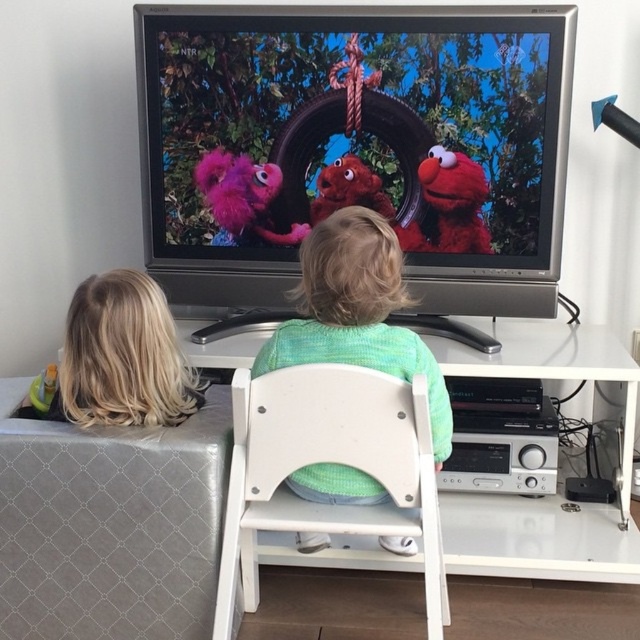
Who is more distant from viewer, (432, 230) or (376, 196)?

Positioned behind is point (376, 196).

Image resolution: width=640 pixels, height=640 pixels. Identify the location of red plush toy at center. (452, 202).

Can you confirm if blonde hair at left is positioned to the right of red plush toy at center?

Incorrect, blonde hair at left is not on the right side of red plush toy at center.

Between point (65, 349) and point (436, 157), which one is positioned in front?

Point (65, 349) is in front.

At what (x,y) coordinates should I click in order to perform the action: click on blonde hair at left. Please return your answer as a coordinate pair (x, y). The height and width of the screenshot is (640, 640). Looking at the image, I should click on (120, 356).

Who is more forward, (387, 291) or (346, 188)?

Point (387, 291) is in front.

Between green knitted sweater at center and fuzzy red elmo at upper center, which one is positioned lower?

green knitted sweater at center

I want to click on green knitted sweater at center, so click(356, 312).